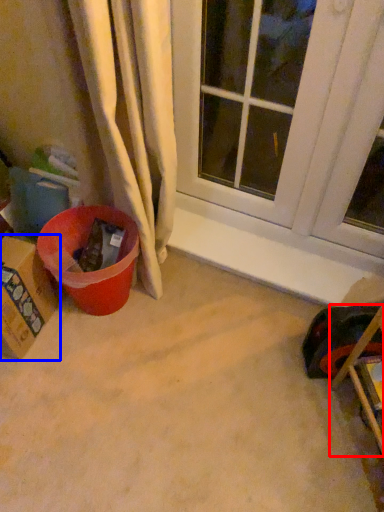
Question: Which object appears closest to the camera in this image, furniture (highlighted by a red box) or cardboard box (highlighted by a blue box)?

Choices:
 (A) furniture
 (B) cardboard box

Answer: (A)